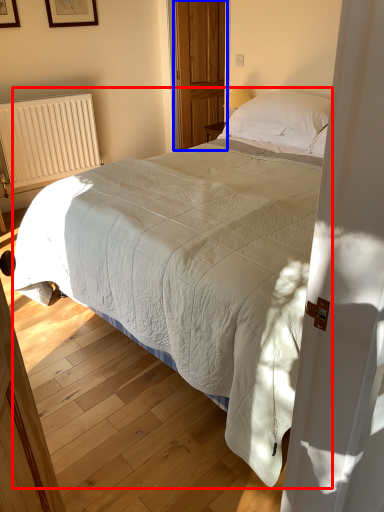
Question: Which of the following is the closest to the observer, bed (highlighted by a red box) or screen door (highlighted by a blue box)?

Choices:
 (A) bed
 (B) screen door

Answer: (A)